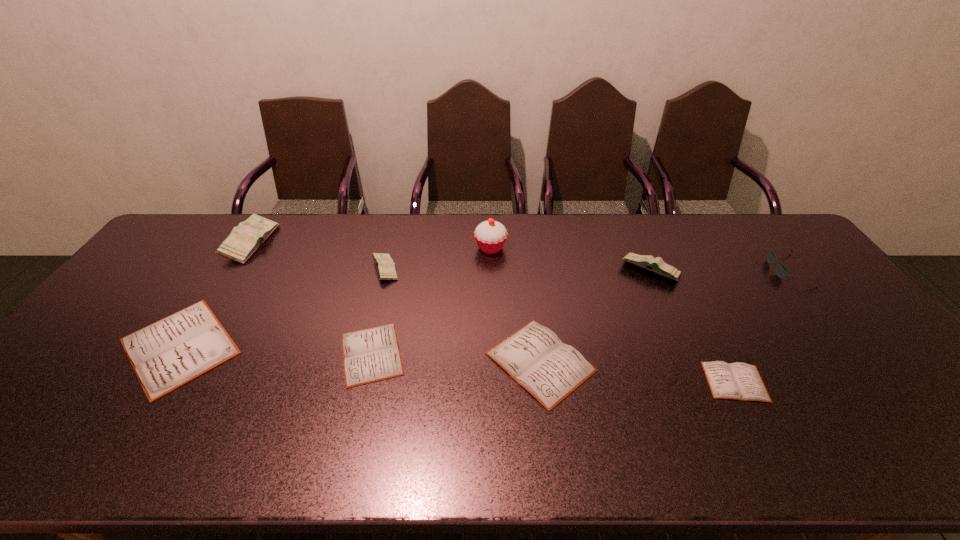
The height and width of the screenshot is (540, 960). Find the location of `unoccupied area between the biggest white diary and the third white diary from right to left`. unoccupied area between the biggest white diary and the third white diary from right to left is located at coordinates (276, 350).

Where is `unoccupied area between the tallest object and the third diary from right to left`? This screenshot has width=960, height=540. unoccupied area between the tallest object and the third diary from right to left is located at coordinates (516, 305).

Identify the location of free spot between the seventh tallest object and the black sunglasses. This screenshot has height=540, width=960. 664,315.

At what (x,y) coordinates should I click in order to perform the action: click on empty location between the sunglasses and the second smallest white diary. Please return your answer as a coordinate pair (x, y). The height and width of the screenshot is (540, 960). Looking at the image, I should click on (580, 312).

Locate an element on the screen. Image resolution: width=960 pixels, height=540 pixels. free space between the shortest diary and the fifth shortest diary is located at coordinates (560, 326).

The height and width of the screenshot is (540, 960). Identify the location of free space between the fifth diary from left to right and the eighth shortest object. click(x=396, y=302).

Find the location of a particular element. The height and width of the screenshot is (540, 960). free space between the seventh shortest object and the second tallest object is located at coordinates (450, 256).

Identify the location of unoccupied area between the black sunglasses and the eighth tallest object. coord(580,312).

Locate which object ranks fourth in proximity to the black sunglasses. Please provide its 2D coordinates. Your answer should be formatted as a tuple, i.e. [(x, y)], where the tuple contains the x and y coordinates of a point satisfying the conditions above.

[(490, 235)]

Where is `object that is the closest to the third tallest diary`? Image resolution: width=960 pixels, height=540 pixels. object that is the closest to the third tallest diary is located at coordinates (373, 354).